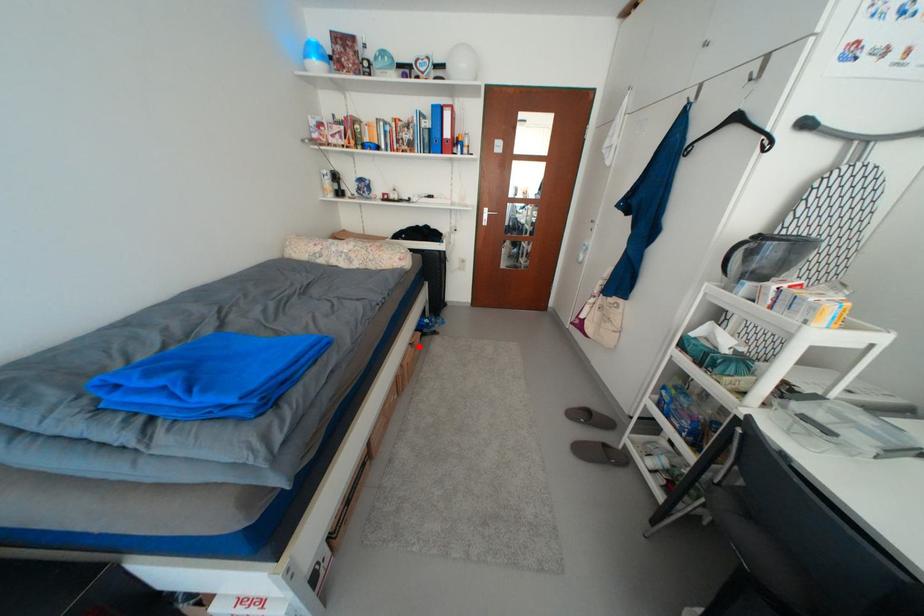
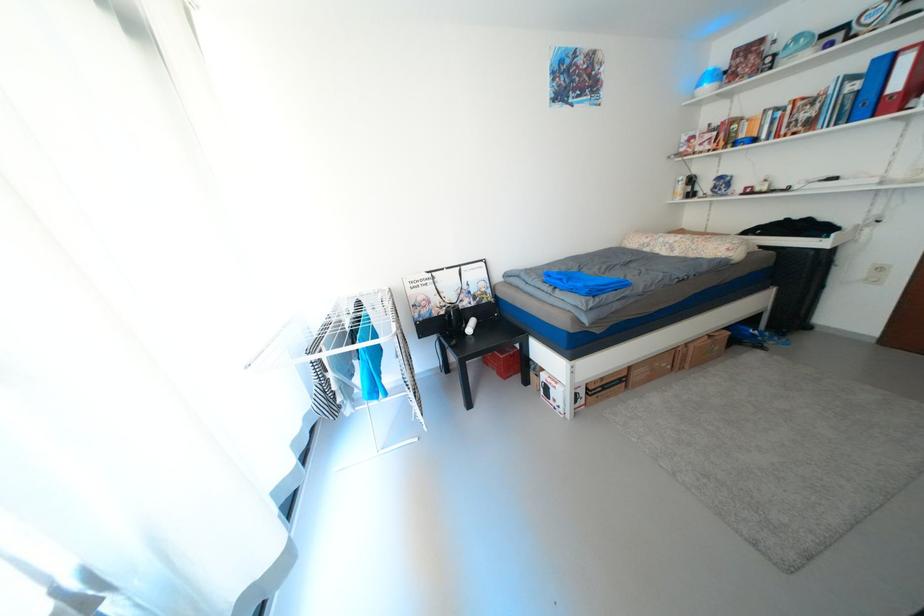
The point at the highlighted location is marked in the first image. Where is the corresponding point in the second image?

(718, 338)